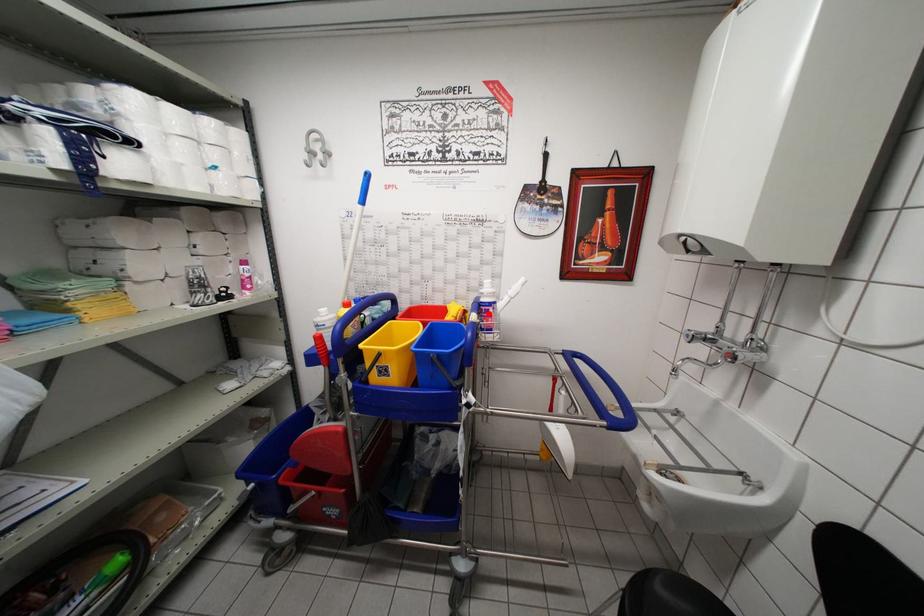
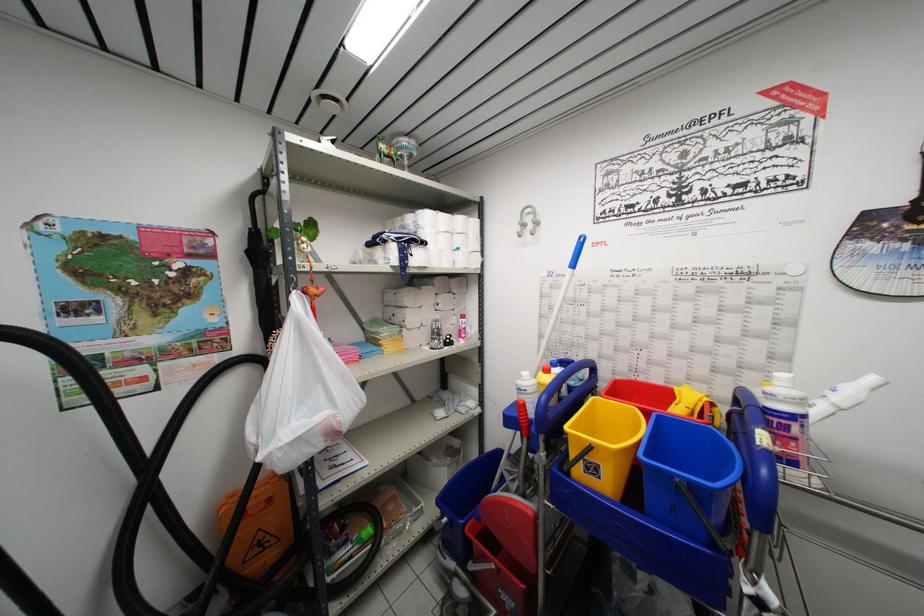
In the second image, find the point that corresponds to the highlighted location in the first image.

(783, 428)